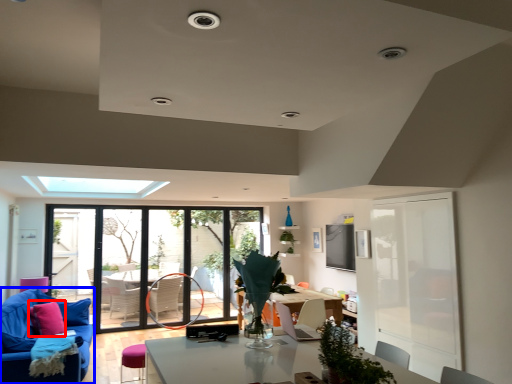
Question: Among these objects, which one is nearest to the camera, pillow (highlighted by a red box) or studio couch (highlighted by a blue box)?

Choices:
 (A) pillow
 (B) studio couch

Answer: (B)